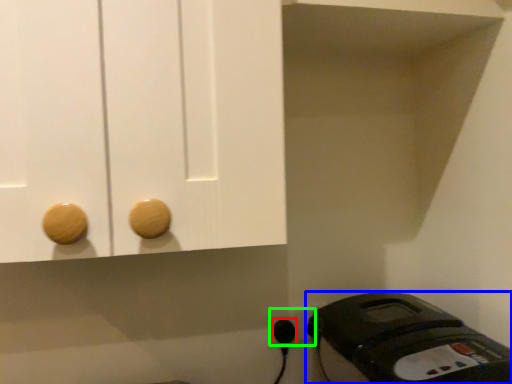
Question: Which is farther away from plug (highlighted by a red box)? home appliance (highlighted by a blue box) or electric outlet (highlighted by a green box)?

Choices:
 (A) home appliance
 (B) electric outlet

Answer: (A)